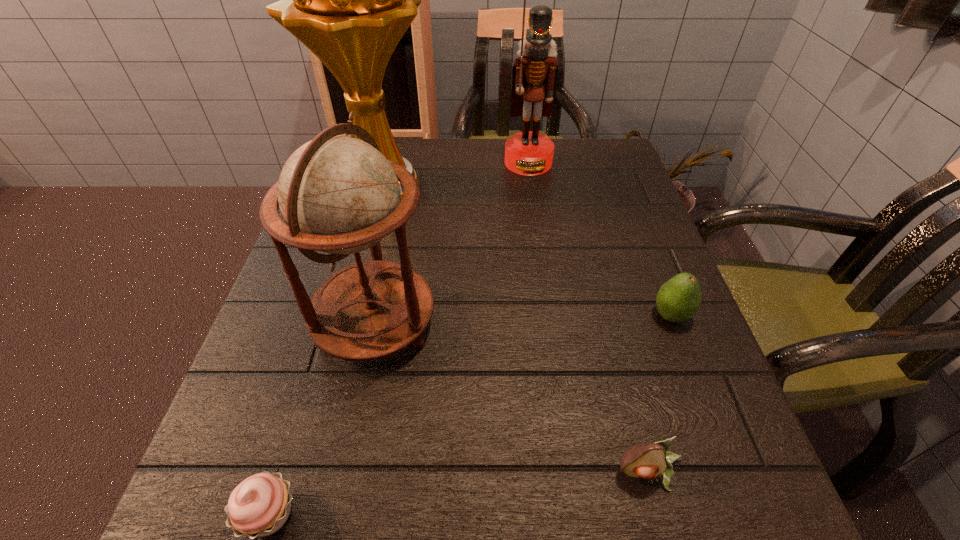
What are the coordinates of `trophy_cup situated at the far edge` in the screenshot? It's located at (349, 0).

This screenshot has height=540, width=960. What are the coordinates of `nutcracker that is at the far edge` in the screenshot? It's located at (534, 73).

Where is `object that is at the near edge`? This screenshot has width=960, height=540. object that is at the near edge is located at coordinates (644, 460).

Locate an element on the screen. trophy_cup at the left edge is located at coordinates (349, 0).

Locate an element on the screen. The width and height of the screenshot is (960, 540). globe that is at the left edge is located at coordinates (338, 194).

Where is `object present at the far left corner`? The image size is (960, 540). object present at the far left corner is located at coordinates (349, 0).

Locate an element on the screen. This screenshot has width=960, height=540. object positioned at the near right corner is located at coordinates (644, 460).

Find the location of a particular element. The height and width of the screenshot is (540, 960). free region at the far edge is located at coordinates (551, 171).

Image resolution: width=960 pixels, height=540 pixels. Identify the location of vacant space at the near edge of the desktop. (420, 497).

At what (x,y) coordinates should I click in order to perform the action: click on blank space at the left edge of the desktop. Please return your answer as a coordinate pair (x, y). Looking at the image, I should click on (278, 341).